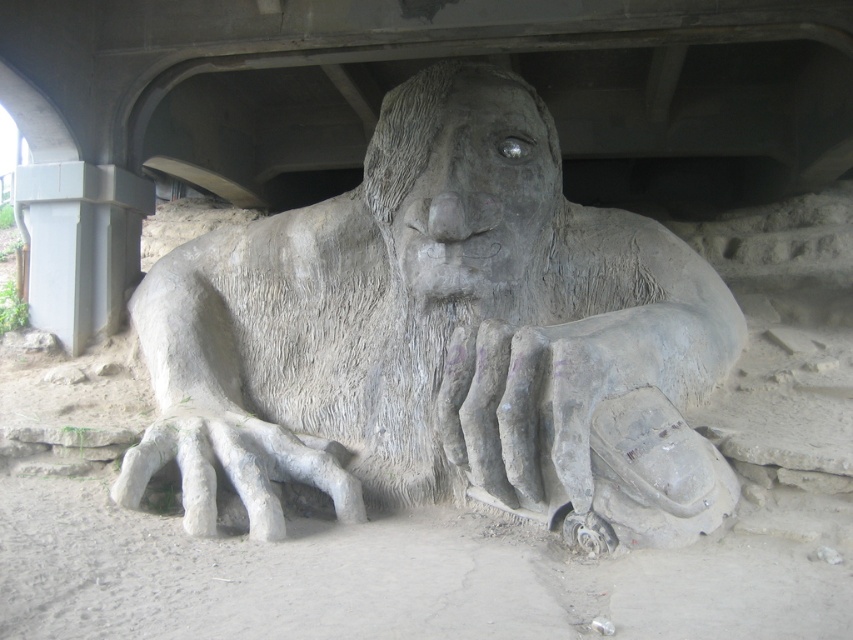
Based on the photo, is gray stone statue at center thinner than gray concrete pillar at left?

No, gray stone statue at center is not thinner than gray concrete pillar at left.

Can you confirm if gray stone statue at center is positioned above gray concrete pillar at left?

No, gray stone statue at center is not above gray concrete pillar at left.

Is point (335, 224) closer to viewer compared to point (85, 164)?

Yes, point (335, 224) is closer to viewer.

At what (x,y) coordinates should I click in order to perform the action: click on gray stone statue at center. Please return your answer as a coordinate pair (x, y). The image size is (853, 640). Looking at the image, I should click on (442, 340).